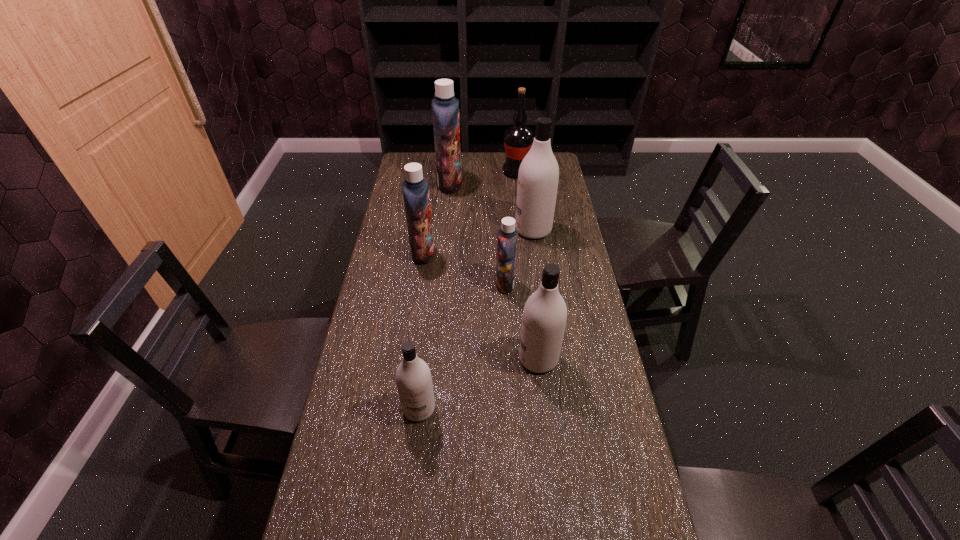
Locate an element on the screen. This screenshot has height=540, width=960. the biggest white shampoo is located at coordinates (538, 175).

Locate an element on the screen. the farthest blue shampoo is located at coordinates (445, 107).

Where is `the biggest blue shampoo`? the biggest blue shampoo is located at coordinates (x=445, y=107).

At what (x,y) coordinates should I click in order to perform the action: click on wine bottle. Please return your answer as a coordinate pair (x, y). Looking at the image, I should click on (518, 139).

Where is `the second biggest blue shampoo`? The height and width of the screenshot is (540, 960). the second biggest blue shampoo is located at coordinates (415, 188).

The width and height of the screenshot is (960, 540). In order to click on the second smallest white shampoo in this screenshot , I will do pos(544,317).

Where is `the second nearest shampoo`? Image resolution: width=960 pixels, height=540 pixels. the second nearest shampoo is located at coordinates (544, 317).

Locate an element on the screen. the rightmost blue shampoo is located at coordinates (507, 236).

I want to click on the nearest blue shampoo, so click(x=507, y=236).

Identify the location of the nearest white shampoo. (414, 383).